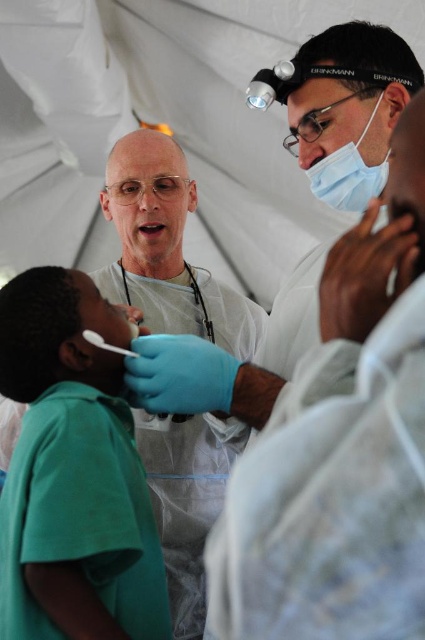
Does white matte gloves at center appear under matte white mask at upper center?

Yes.

Who is more distant from viewer, (192, 561) or (359, 205)?

Positioned behind is point (192, 561).

You are a GUI agent. You are given a task and a screenshot of the screen. Output one action in this format:
    pyautogui.click(x=<x>, y=<y>)
    Task: Click on the white matte gloves at center
    
    Given the screenshot: What is the action you would take?
    pyautogui.click(x=166, y=250)

Between point (322, 198) and point (201, 301), which one is positioned behind?

Positioned behind is point (201, 301).

Is matte white mask at upper center shorter than black rubber stethoscope at center?

Indeed, matte white mask at upper center has a lesser height compared to black rubber stethoscope at center.

Which is in front, point (376, 104) or point (124, 280)?

Positioned in front is point (376, 104).

Locate an element on the screen. The width and height of the screenshot is (425, 640). matte white mask at upper center is located at coordinates (348, 176).

Is green matte shirt at lower left positioned before white matte gloves at center?

Yes, it is.

Between green matte shirt at lower left and white matte gloves at center, which one has more height?

green matte shirt at lower left is taller.

Is point (42, 451) less distant than point (246, 323)?

Yes, it is.

Identify the location of green matte shirt at lower left. (73, 474).